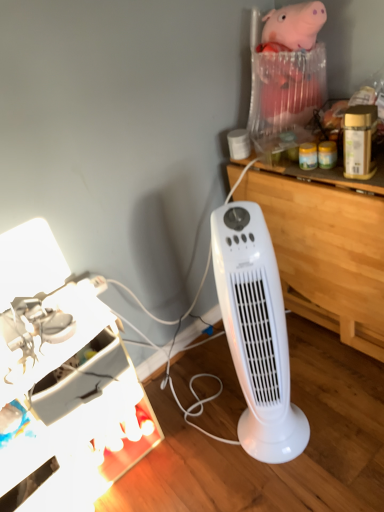
The height and width of the screenshot is (512, 384). In order to click on free location above metallic silver desk lamp at lower left (from a real-world perspective) in this screenshot , I will do `click(37, 340)`.